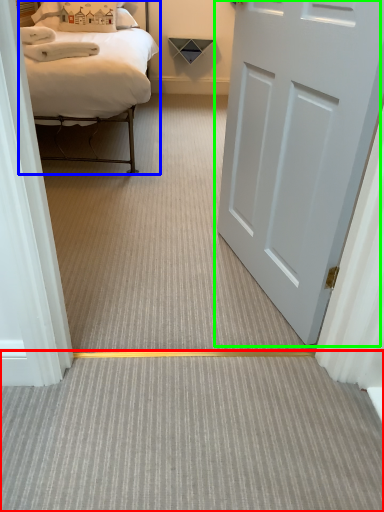
Question: Based on their relative distances, which object is farther from plain (highlighted by a red box)? Choose from bed (highlighted by a blue box) and door (highlighted by a green box).

Choices:
 (A) bed
 (B) door

Answer: (A)